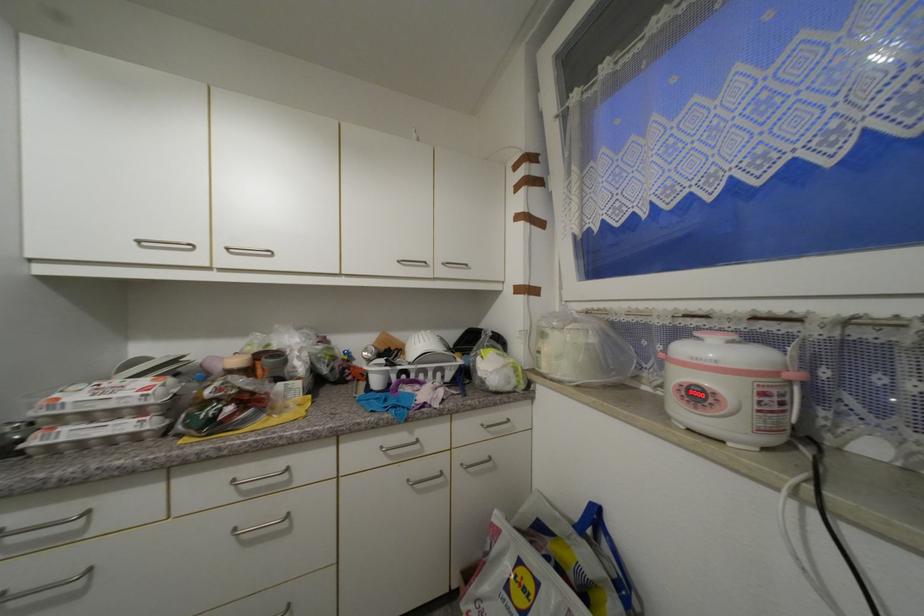
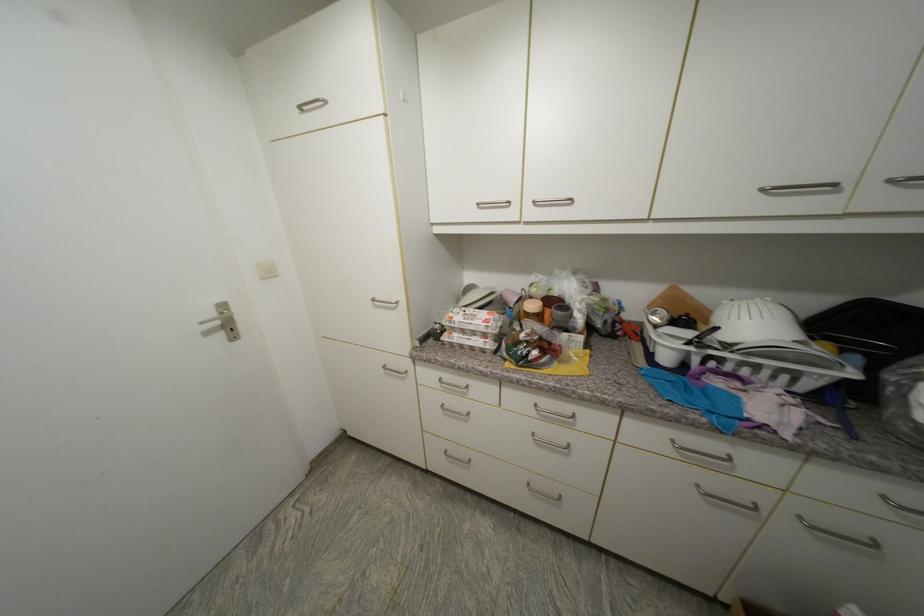
Locate, in the second image, the point that corresponds to (234,251) in the first image.

(540, 204)